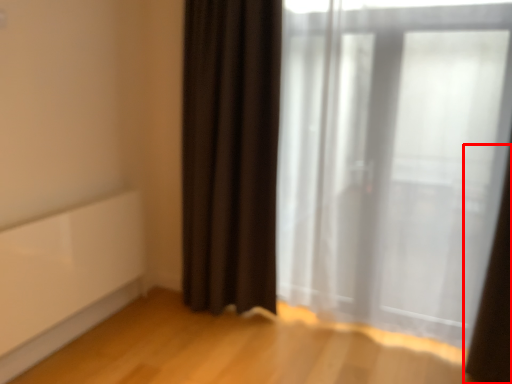
Question: From the image's perspective, what is the correct spatial positioning of curtain (annotated by the red box) in reference to curtain?

Choices:
 (A) above
 (B) below

Answer: (B)